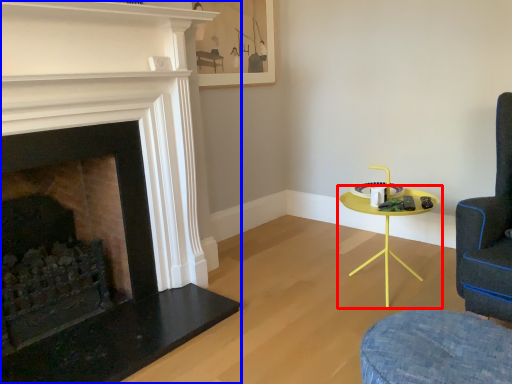
Question: Which object appears farthest to the camera in this image, table (highlighted by a red box) or fireplace (highlighted by a blue box)?

Choices:
 (A) table
 (B) fireplace

Answer: (A)